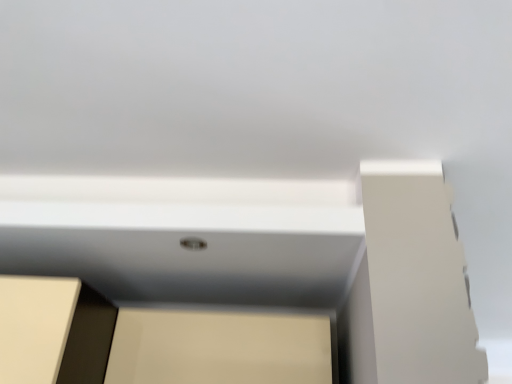
Measure the distance between point (104, 244) and camera.

1.05 meters.

This screenshot has height=384, width=512. What do you see at coordinates (270, 256) in the screenshot?
I see `matte white vanity at lower left` at bounding box center [270, 256].

Identify the location of matte white vanity at lower left. The image size is (512, 384). (270, 256).

Identify the location of matte white vanity at lower left. The width and height of the screenshot is (512, 384). (270, 256).